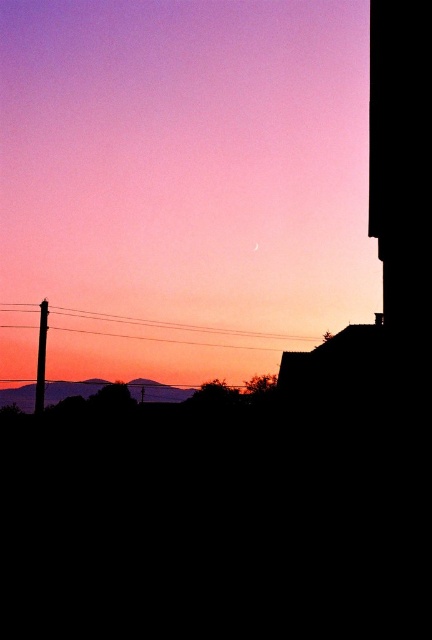
Is silvery metallic crescent moon at upper center wider than black wire at lower center?

Yes.

Describe the element at coordinates (181, 184) in the screenshot. I see `silvery metallic crescent moon at upper center` at that location.

Where is `silvery metallic crescent moon at upper center`? The width and height of the screenshot is (432, 640). silvery metallic crescent moon at upper center is located at coordinates (181, 184).

Can you confirm if silvery metallic crescent moon at upper center is bigger than silvery metallic mountains at lower center?

Correct, silvery metallic crescent moon at upper center is larger in size than silvery metallic mountains at lower center.

Between silvery metallic crescent moon at upper center and silvery metallic mountains at lower center, which one appears on the right side from the viewer's perspective?

From the viewer's perspective, silvery metallic crescent moon at upper center appears more on the right side.

Who is more distant from viewer, (155, 262) or (156, 387)?

Positioned behind is point (155, 262).

Find the location of `silvery metallic crescent moon at upper center`. silvery metallic crescent moon at upper center is located at coordinates (181, 184).

Does point (81, 330) come behind point (41, 326)?

Yes, point (81, 330) is farther from viewer.

Which of these two, black wire at lower center or smooth wood telegraph pole at left, stands shorter?

Standing shorter between the two is black wire at lower center.

At what (x,y) coordinates should I click in order to perform the action: click on black wire at lower center. Please return your answer as a coordinate pair (x, y). The height and width of the screenshot is (640, 432). Looking at the image, I should click on (181, 324).

This screenshot has width=432, height=640. I want to click on black wire at lower center, so click(181, 324).